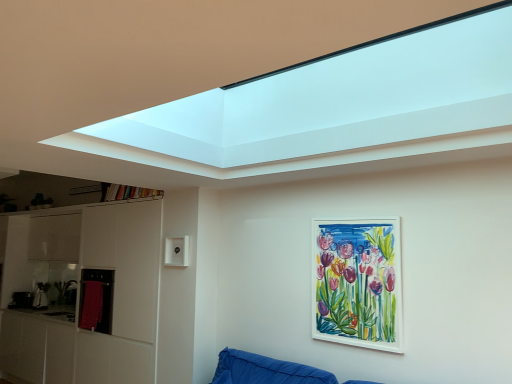
What do you see at coordinates (96, 300) in the screenshot? The image size is (512, 384). I see `red towel at left` at bounding box center [96, 300].

Where is `red towel at left`? red towel at left is located at coordinates (96, 300).

The width and height of the screenshot is (512, 384). Find the location of `white matte picture frame at center-right`. white matte picture frame at center-right is located at coordinates (358, 282).

Image resolution: width=512 pixels, height=384 pixels. Describe the element at coordinates (358, 282) in the screenshot. I see `white matte picture frame at center-right` at that location.

At what (x,y) coordinates should I click in order to perform the action: click on red towel at left. Please return your answer as a coordinate pair (x, y). This screenshot has height=384, width=512. Looking at the image, I should click on (96, 300).

Which is more to the right, red towel at left or white matte picture frame at center-right?

Positioned to the right is white matte picture frame at center-right.

Is red towel at left in front of white matte picture frame at center-right?

No, the depth of red towel at left is greater than that of white matte picture frame at center-right.

Is point (91, 276) closer or farther from the camera than point (324, 337)?

Point (91, 276) is farther from the camera than point (324, 337).

From the image's perspective, which object appears higher, red towel at left or white matte picture frame at center-right?

white matte picture frame at center-right appears higher in the image.

From a real-world perspective, is red towel at left physically above white matte picture frame at center-right?

Actually, red towel at left is physically below white matte picture frame at center-right in the real world.

In terms of width, does red towel at left look wider or thinner when compared to white matte picture frame at center-right?

red towel at left is wider than white matte picture frame at center-right.

Is red towel at left taller than white matte picture frame at center-right?

No, red towel at left is not taller than white matte picture frame at center-right.

Can you confirm if red towel at left is smaller than white matte picture frame at center-right?

Incorrect, red towel at left is not smaller in size than white matte picture frame at center-right.

Can white matte picture frame at center-right be found inside red towel at left?

No, white matte picture frame at center-right is not surrounded by red towel at left.

Is red towel at left touching white matte picture frame at center-right?

No, red towel at left is not in contact with white matte picture frame at center-right.

Could you tell me if red towel at left is facing white matte picture frame at center-right?

No, red towel at left is not facing towards white matte picture frame at center-right.

What's the angular difference between red towel at left and white matte picture frame at center-right's facing directions?

There is a 0.12-degree angle between the facing directions of red towel at left and white matte picture frame at center-right.

Where is `picture frame that is above the red towel at left (from a real-world perspective)`? The height and width of the screenshot is (384, 512). picture frame that is above the red towel at left (from a real-world perspective) is located at coordinates (358, 282).

Considering the positions of objects white matte picture frame at center-right and red towel at left in the image provided, who is more to the left, white matte picture frame at center-right or red towel at left?

From the viewer's perspective, red towel at left appears more on the left side.

Looking at this image, is white matte picture frame at center-right in front of or behind red towel at left in the image?

Clearly, white matte picture frame at center-right is in front of red towel at left.

Between point (329, 249) and point (87, 293), which one is positioned in front?

Positioned in front is point (329, 249).

From the image's perspective, is white matte picture frame at center-right above or below red towel at left?

From the image's perspective, white matte picture frame at center-right appears above red towel at left.

From a real-world perspective, is white matte picture frame at center-right positioned under red towel at left based on gravity?

No, from a real-world perspective, white matte picture frame at center-right is not below red towel at left.

Considering the sizes of objects white matte picture frame at center-right and red towel at left in the image provided, who is thinner, white matte picture frame at center-right or red towel at left?

Thinner between the two is white matte picture frame at center-right.

Considering the sizes of objects white matte picture frame at center-right and red towel at left in the image provided, who is taller, white matte picture frame at center-right or red towel at left?

Standing taller between the two is white matte picture frame at center-right.

Looking at the image, does white matte picture frame at center-right seem bigger or smaller compared to red towel at left?

In the image, white matte picture frame at center-right appears to be smaller than red towel at left.

Is red towel at left a part of white matte picture frame at center-right?

No, red towel at left is not inside white matte picture frame at center-right.

Is the surface of white matte picture frame at center-right in direct contact with red towel at left?

white matte picture frame at center-right and red towel at left are not in contact.

Is white matte picture frame at center-right facing towards red towel at left?

No, white matte picture frame at center-right does not turn towards red towel at left.

What's the angular difference between white matte picture frame at center-right and red towel at left's facing directions?

0.12 degrees.

Measure the distance from white matte picture frame at center-right to red towel at left.

They are 7.88 feet apart.

The image size is (512, 384). Find the location of `picture frame above the red towel at left (from the image's perspective)`. picture frame above the red towel at left (from the image's perspective) is located at coordinates (358, 282).

The width and height of the screenshot is (512, 384). In order to click on cabinet located on the left of white matte picture frame at center-right in this screenshot , I will do `click(96, 300)`.

Where is `picture frame lying on the right of red towel at left`? This screenshot has width=512, height=384. picture frame lying on the right of red towel at left is located at coordinates (358, 282).